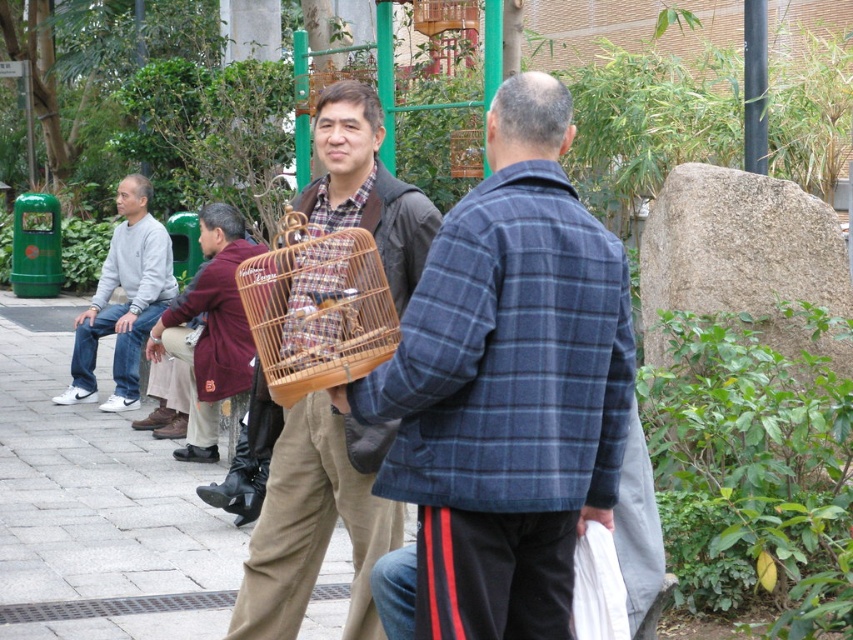
You are a tailor observing two jackets displayed in a store window. The plaid woolen jacket at center and the maroon fabric jacket at center are both on display. Which jacket is narrower?

The plaid woolen jacket at center is narrower than the maroon fabric jacket at center.

You are a photographer standing in the park. You want to take a photo of the wooden birdcage at center and the matte gray sweatshirt at left. Which object should you focus on first if you want to capture both in the same frame without moving the camera?

The wooden birdcage at center is below the matte gray sweatshirt at left, so you should focus on the matte gray sweatshirt at left first to ensure both are in the frame.

You are a photographer trying to capture a closeup of the wooden birdcage at center while also including the matte gray sweatshirt at left in the frame. Given their sizes, will you need to adjust your camera settings to focus on both objects simultaneously?

The wooden birdcage at center is smaller in width than the matte gray sweatshirt at left. To capture both in focus, adjust your camera to a wider aperture or closer distance to accommodate their size difference.